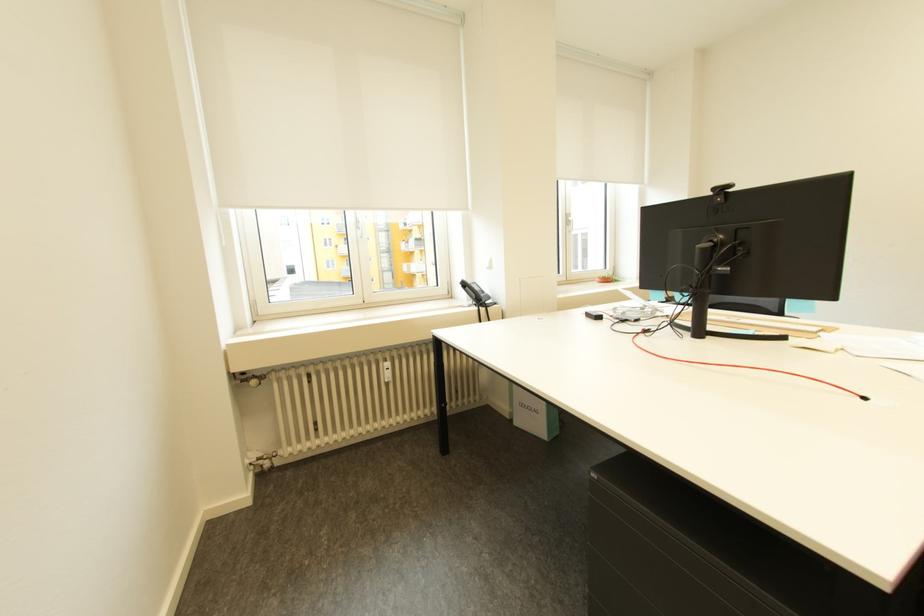
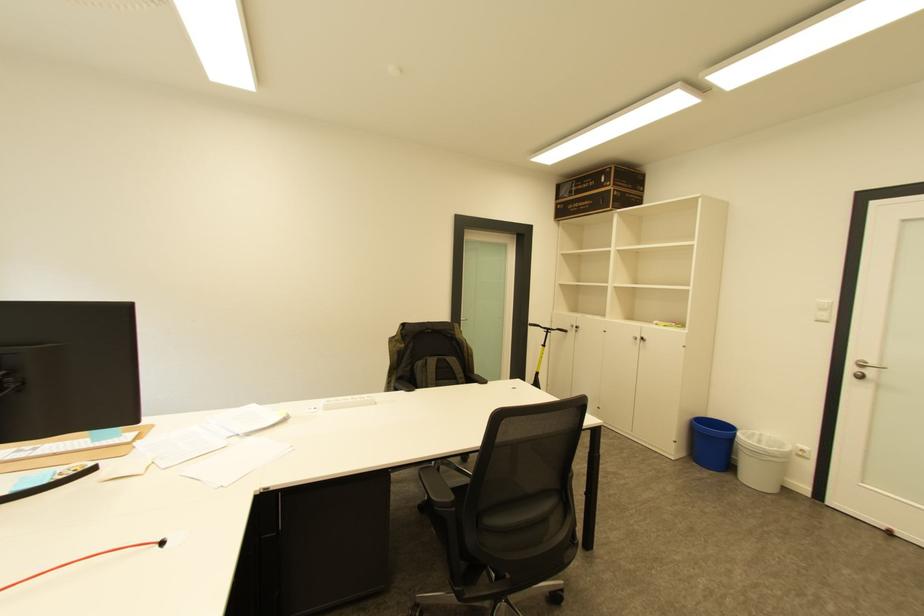
Question: The camera is either moving clockwise (left) or counter-clockwise (right) around the object. The first image is from the beginning of the video and the second image is from the end. Is the camera moving left or right when shooting the video?

Choices:
 (A) Left
 (B) Right

Answer: (A)